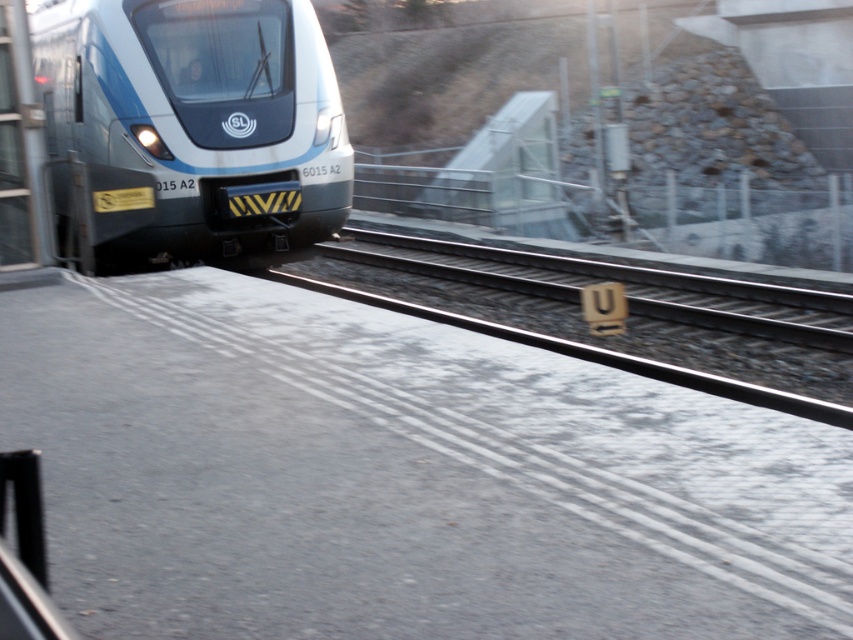
Question: Which of the following is the closest to the observer?

Choices:
 (A) (450, 317)
 (B) (102, 76)

Answer: (A)

Question: Which point is farther to the camera?

Choices:
 (A) metallic silver train at left
 (B) smooth concrete train track at center

Answer: (A)

Question: Does metallic silver train at left lie behind smooth concrete train track at center?

Choices:
 (A) yes
 (B) no

Answer: (A)

Question: Among these points, which one is farthest from the camera?

Choices:
 (A) (369, 275)
 (B) (318, 68)

Answer: (A)

Question: Can you confirm if metallic silver train at left is wider than smooth concrete train track at center?

Choices:
 (A) no
 (B) yes

Answer: (A)

Question: Is metallic silver train at left closer to camera compared to smooth concrete train track at center?

Choices:
 (A) yes
 (B) no

Answer: (B)